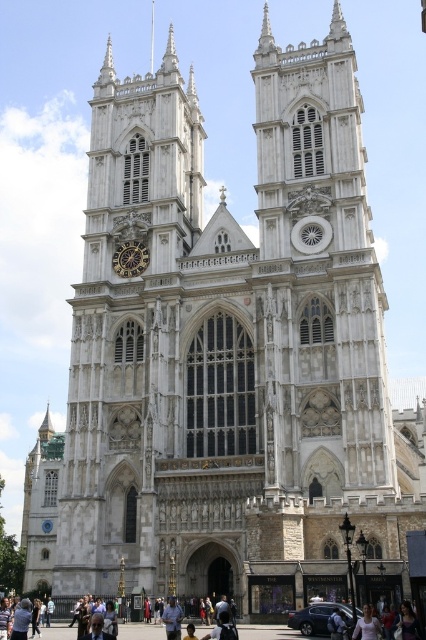
Question: Which of the following is the closest to the observer?

Choices:
 (A) (365, 605)
 (B) (127, 262)
 (C) (167, 620)

Answer: (C)

Question: Can you confirm if white matte shirt at lower center is smaller than light blue jeans at center?

Choices:
 (A) yes
 (B) no

Answer: (A)

Question: Is goldmetallicclock at left positioned before white matte shirt at lower center?

Choices:
 (A) no
 (B) yes

Answer: (A)

Question: Which point is farther to the camera?

Choices:
 (A) goldmetallicclock at left
 (B) light blue jeans at center

Answer: (A)

Question: Estimate the real-world distances between objects in this image. Which object is closer to the goldmetallicclock at left?

Choices:
 (A) white matte shirt at lower center
 (B) light blue jeans at center

Answer: (B)

Question: Does white matte shirt at lower center have a greater width compared to light blue jeans at center?

Choices:
 (A) yes
 (B) no

Answer: (A)